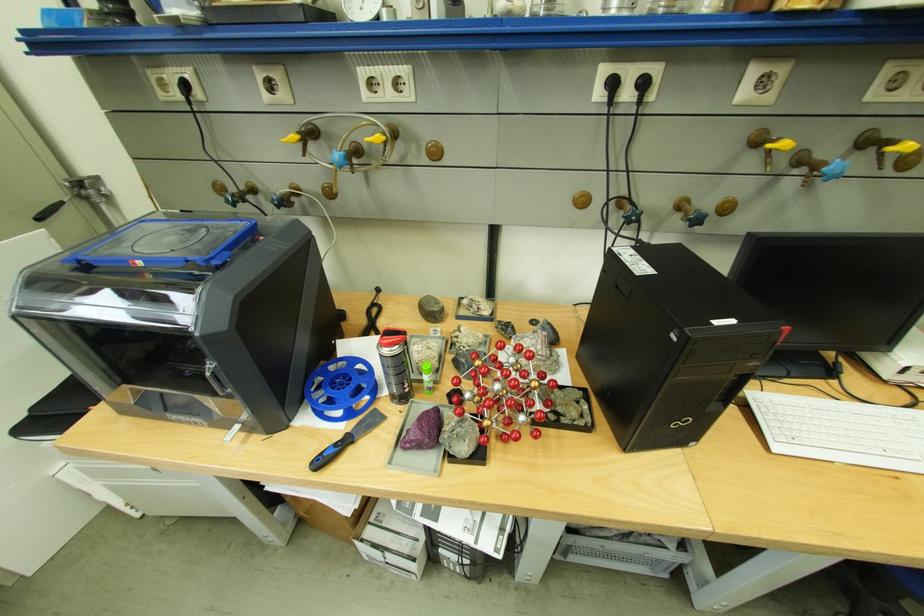
Image resolution: width=924 pixels, height=616 pixels. I want to click on spray can nozzle, so coord(393,351).